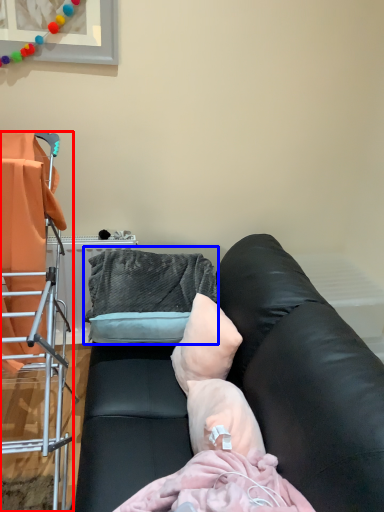
Question: Which object is closer to the camera taking this photo, furniture (highlighted by a red box) or bean bag chair (highlighted by a blue box)?

Choices:
 (A) furniture
 (B) bean bag chair

Answer: (A)